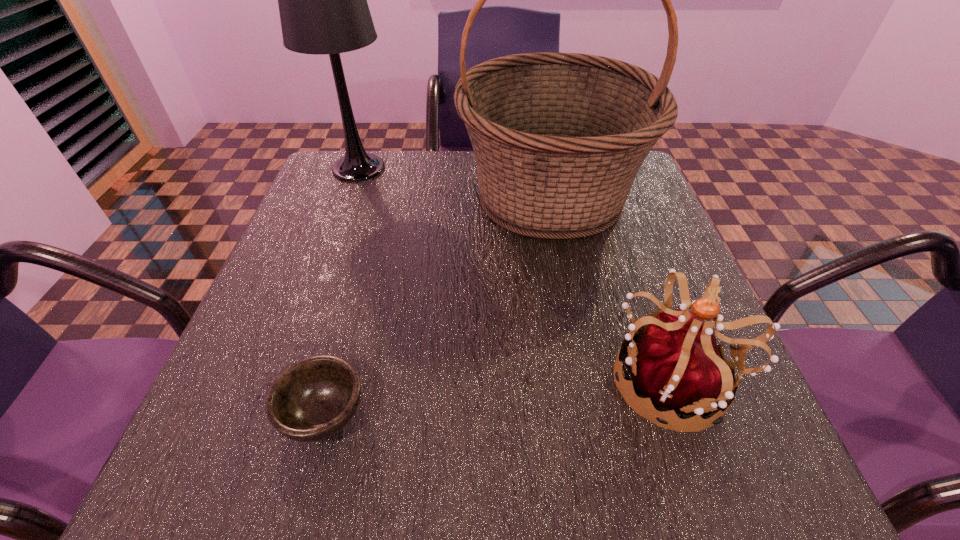
At what (x,y) coordinates should I click in order to perform the action: click on basket. Please return your answer as a coordinate pair (x, y). Looking at the image, I should click on (558, 138).

This screenshot has width=960, height=540. I want to click on table lamp, so click(322, 0).

I want to click on tiara, so 677,364.

You are a GUI agent. You are given a task and a screenshot of the screen. Output one action in this format:
    pyautogui.click(x=<x>, y=<y>)
    Task: Click on the bowl
    The image size is (960, 540).
    Given the screenshot: What is the action you would take?
    pyautogui.click(x=314, y=398)

Identify the location of vacant region located on the left of the basket. tap(372, 196).

You are a GUI agent. You are given a task and a screenshot of the screen. Output one action in this format:
    pyautogui.click(x=<x>, y=<y>)
    Task: Click on the vacant space situated on the right of the table lamp
    This screenshot has width=960, height=540.
    Given the screenshot: What is the action you would take?
    pyautogui.click(x=536, y=168)

What are the coordinates of `vacant point located 0.320m on the front-facing side of the tiara` in the screenshot? It's located at (412, 380).

The image size is (960, 540). Find the location of `free space located 0.250m on the front-facing side of the tiara`. free space located 0.250m on the front-facing side of the tiara is located at coordinates (455, 380).

This screenshot has width=960, height=540. I want to click on blank space located on the front-facing side of the tiara, so click(x=430, y=380).

Image resolution: width=960 pixels, height=540 pixels. What are the coordinates of `free space located on the back of the bowl` in the screenshot? It's located at (352, 307).